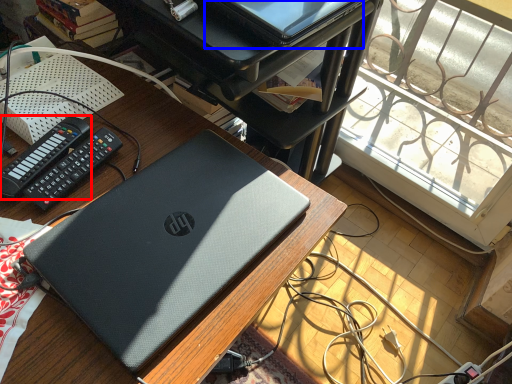
Question: Among these objects, which one is farthest to the camera, control (highlighted by a red box) or computer (highlighted by a blue box)?

Choices:
 (A) control
 (B) computer

Answer: (B)